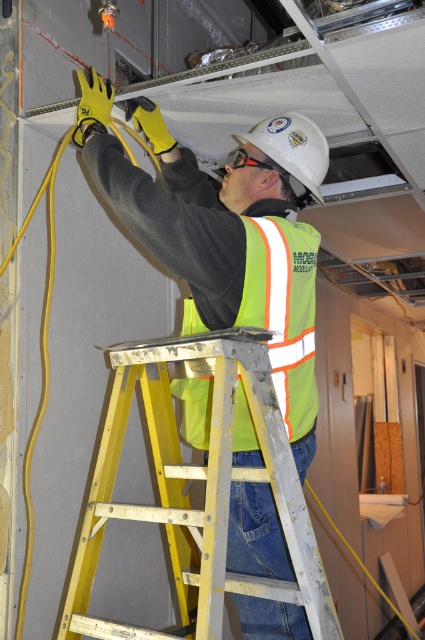
Question: Which of the following is the closest to the observer?

Choices:
 (A) high-visibility fabric safety vest at center
 (B) yellow metallic ladder at center

Answer: (B)

Question: Is yellow metallic ladder at center to the right of high-visibility fabric safety vest at center from the viewer's perspective?

Choices:
 (A) no
 (B) yes

Answer: (A)

Question: Does yellow metallic ladder at center have a smaller size compared to high-visibility fabric safety vest at center?

Choices:
 (A) no
 (B) yes

Answer: (A)

Question: Considering the relative positions of yellow metallic ladder at center and high-visibility fabric safety vest at center in the image provided, where is yellow metallic ladder at center located with respect to high-visibility fabric safety vest at center?

Choices:
 (A) right
 (B) left

Answer: (B)